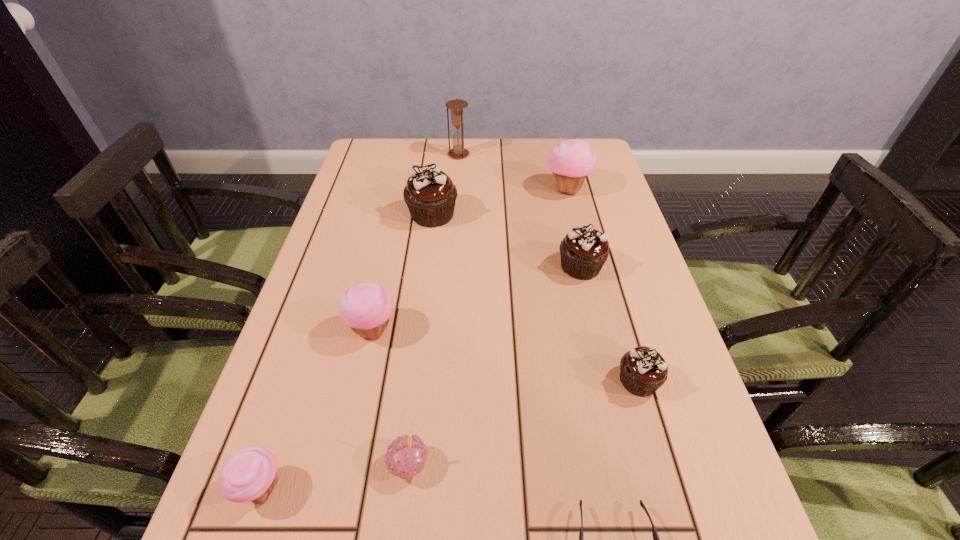
Identify the location of the third pink cupcake from left to right. (406, 456).

Find the location of a particular element. This screenshot has width=960, height=540. the sixth farthest object is located at coordinates (643, 370).

Identify the location of the nearest brown cupcake. (643, 370).

Locate an element on the screen. Image resolution: width=960 pixels, height=540 pixels. the leftmost pink cupcake is located at coordinates (250, 474).

Find the location of a particular element. The width and height of the screenshot is (960, 540). the leftmost cupcake is located at coordinates (250, 474).

The width and height of the screenshot is (960, 540). I want to click on vacant area located on the front of the hourglass, so point(455,208).

Locate an element on the screen. The height and width of the screenshot is (540, 960). vacant space situated on the right of the biggest brown cupcake is located at coordinates (545, 215).

Where is `vacant region located 0.090m on the left of the farthest pink cupcake`? This screenshot has width=960, height=540. vacant region located 0.090m on the left of the farthest pink cupcake is located at coordinates (515, 190).

The height and width of the screenshot is (540, 960). In order to click on vacant space situated 0.270m on the front of the second biggest brown cupcake in this screenshot , I will do (x=608, y=386).

The width and height of the screenshot is (960, 540). What are the coordinates of `vacant region located on the front of the third pink cupcake from right to left` in the screenshot? It's located at (353, 420).